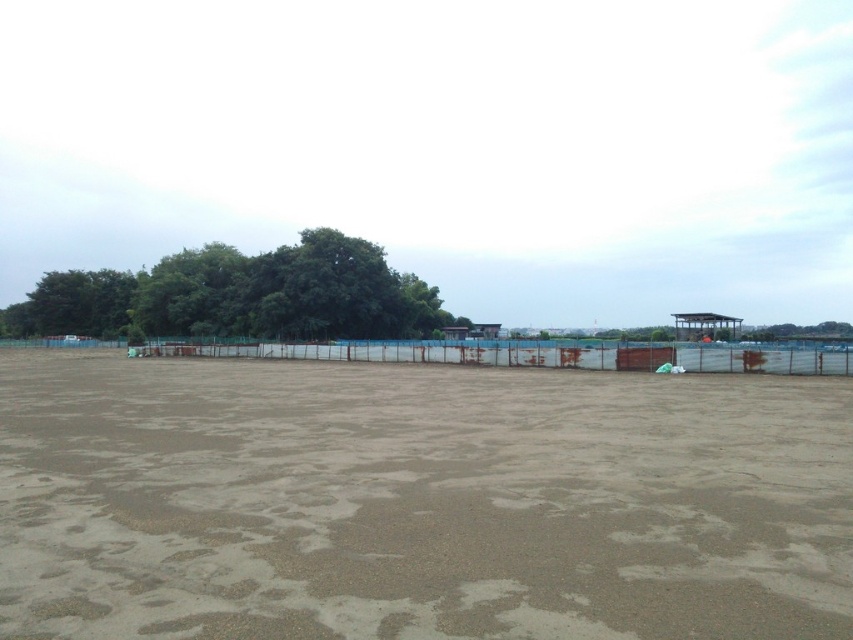
You are a landscape architect planning to plant a new row of trees between the brown sandy dirt field at center and the green leafy tree at upper left. If each tree requires 5 meters of space between them, how many trees can you plant in a straight line between these two points?

The distance between the brown sandy dirt field at center and the green leafy tree at upper left is 68.43 meters. Each tree needs 5 meters of space. Dividing 68.43 by 5 gives approximately 13.686. Since you can only plant whole trees, you can plant 13 trees, with the last tree being slightly closer than 5 meters to the green leafy tree at upper left.

You are a landscape architect planning to plant new trees in the brown sandy dirt field at center and the green leafy tree at upper left. Based on their sizes, which location would allow for more trees to be planted?

The brown sandy dirt field at center is smaller than the green leafy tree at upper left, so more trees can be planted in the green leafy tree at upper left.